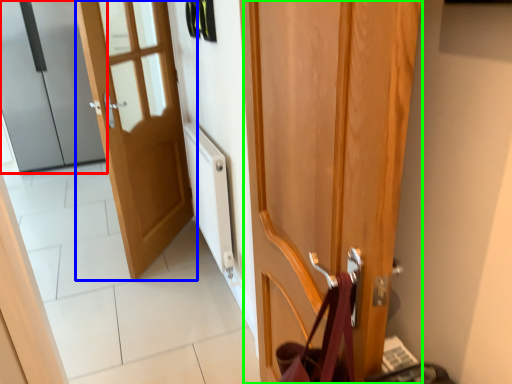
Question: Based on their relative distances, which object is nearer to door (highlighted by a red box)? Choose from door (highlighted by a blue box) and door (highlighted by a green box).

Choices:
 (A) door
 (B) door

Answer: (A)